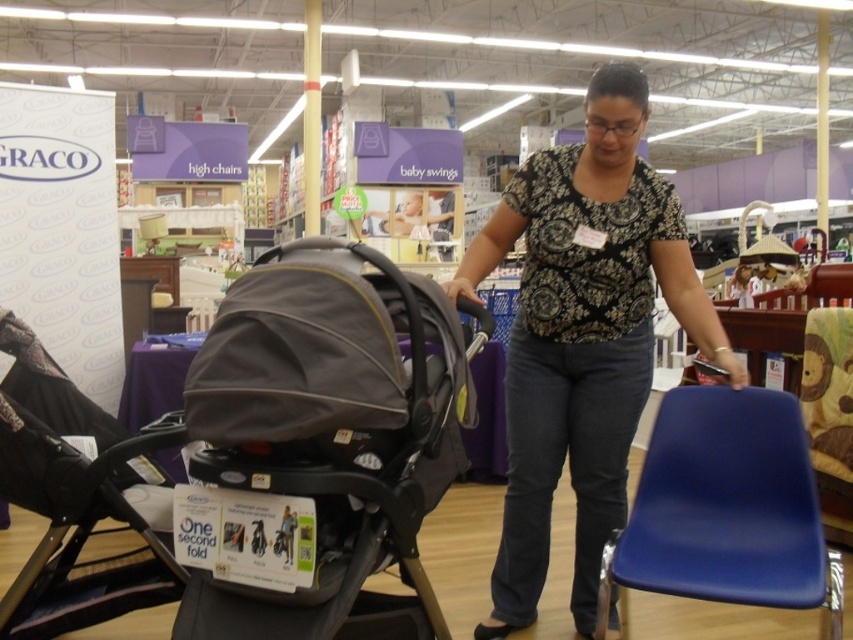
You are a customer in the baby products section and want to pick up both the printed cotton blouse at center and the blue plastic chair at lower right. Which item will you reach first if you move straight ahead?

The printed cotton blouse at center is closer to you than the blue plastic chair at lower right, so you will reach it first.

Looking at this image, you are a parent trying to decide between two strollers in the baby products section. You notice the gray fabric stroller at center and the matte black stroller at center. Based on their widths, which one might require more space to maneuver?

The gray fabric stroller at center might require more space to maneuver since it is wider than the matte black stroller at center according to the description.

You are a customer in the baby products section of a retail store. You see a printed cotton blouse at center. Where is the printed cotton blouse located in the store section?

The printed cotton blouse at center is located at point (582, 337) in the store section.